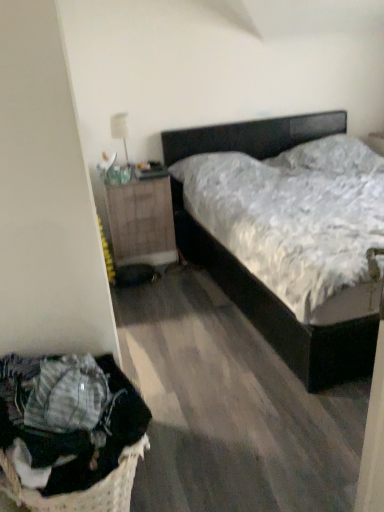
What is the approximate width of wooden nightstand at left?

22.83 inches.

Where is `wooden nightstand at left`? wooden nightstand at left is located at coordinates (141, 221).

Identify the location of wooden nightstand at left. click(x=141, y=221).

In the image, is wooden nightstand at left on the left side or the right side of black matte bed at center?

wooden nightstand at left is positioned on black matte bed at center's left side.

Based on the photo, does wooden nightstand at left have a lesser height compared to black matte bed at center?

Yes, wooden nightstand at left is shorter than black matte bed at center.

Is wooden nightstand at left inside the boundaries of black matte bed at center, or outside?

wooden nightstand at left cannot be found inside black matte bed at center.

Considering the sizes of objects wooden nightstand at left and black matte bed at center in the image provided, who is bigger, wooden nightstand at left or black matte bed at center?

Bigger between the two is black matte bed at center.

What's the angular difference between woven fabric laundry basket at lower left and black matte bed at center's facing directions?

The facing directions of woven fabric laundry basket at lower left and black matte bed at center are 89.5 degrees apart.

Is woven fabric laundry basket at lower left bigger or smaller than black matte bed at center?

In the image, woven fabric laundry basket at lower left appears to be smaller than black matte bed at center.

From a real-world perspective, which object rests below the other?

woven fabric laundry basket at lower left is physically lower.

Does woven fabric laundry basket at lower left touch black matte bed at center?

woven fabric laundry basket at lower left is not next to black matte bed at center, and they're not touching.

Which object is wider, wooden nightstand at left or woven fabric laundry basket at lower left?

Wider between the two is wooden nightstand at left.

From the image's perspective, is wooden nightstand at left located above or below woven fabric laundry basket at lower left?

wooden nightstand at left is situated higher than woven fabric laundry basket at lower left in the image.

Identify the location of laundry basket lying on the right of wooden nightstand at left. point(71,432).

Is woven fabric laundry basket at lower left surrounded by wooden nightstand at left?

No, woven fabric laundry basket at lower left is not a part of wooden nightstand at left.

Is black matte bed at center positioned before woven fabric laundry basket at lower left?

No, the depth of black matte bed at center is greater than that of woven fabric laundry basket at lower left.

From a real-world perspective, is black matte bed at center located beneath woven fabric laundry basket at lower left?

No, from a real-world perspective, black matte bed at center is not below woven fabric laundry basket at lower left.

From the picture: Is black matte bed at center not inside woven fabric laundry basket at lower left?

Absolutely, black matte bed at center is external to woven fabric laundry basket at lower left.

Are black matte bed at center and woven fabric laundry basket at lower left making contact?

black matte bed at center and woven fabric laundry basket at lower left are clearly separated.

Considering the sizes of black matte bed at center and wooden nightstand at left in the image, is black matte bed at center taller or shorter than wooden nightstand at left?

In the image, black matte bed at center appears to be taller than wooden nightstand at left.

From a real-world perspective, relative to wooden nightstand at left, is black matte bed at center vertically above or below?

black matte bed at center is situated higher than wooden nightstand at left in the real world.

Is point (333, 362) farther from viewer compared to point (154, 230)?

No, it is in front of (154, 230).

Considering the sizes of objects black matte bed at center and wooden nightstand at left in the image provided, who is bigger, black matte bed at center or wooden nightstand at left?

With larger size is black matte bed at center.

Could you tell me if woven fabric laundry basket at lower left is facing wooden nightstand at left?

No, woven fabric laundry basket at lower left is not facing towards wooden nightstand at left.

In terms of size, does woven fabric laundry basket at lower left appear bigger or smaller than wooden nightstand at left?

In the image, woven fabric laundry basket at lower left appears to be smaller than wooden nightstand at left.

Between woven fabric laundry basket at lower left and wooden nightstand at left, which one has larger width?

Wider between the two is wooden nightstand at left.

Can you confirm if woven fabric laundry basket at lower left is shorter than wooden nightstand at left?

Yes.

What are the coordinates of `bed in front of the wooden nightstand at left` in the screenshot? It's located at (280, 313).

You are a GUI agent. You are given a task and a screenshot of the screen. Output one action in this format:
    pyautogui.click(x=<x>, y=<y>)
    Task: Click on the laundry basket that is under the black matte bed at center (from a real-world perspective)
    Image resolution: width=384 pixels, height=512 pixels.
    Given the screenshot: What is the action you would take?
    pyautogui.click(x=71, y=432)

Looking at the image, which one is located further to black matte bed at center, woven fabric laundry basket at lower left or wooden nightstand at left?

The object further to black matte bed at center is woven fabric laundry basket at lower left.

Considering their positions, is woven fabric laundry basket at lower left positioned further to wooden nightstand at left than black matte bed at center?

woven fabric laundry basket at lower left lies further to wooden nightstand at left than the other object.

From the image, which object appears to be nearer to wooden nightstand at left, black matte bed at center or woven fabric laundry basket at lower left?

black matte bed at center is positioned closer to the anchor wooden nightstand at left.

Based on their spatial positions, is wooden nightstand at left or woven fabric laundry basket at lower left further from black matte bed at center?

Among the two, woven fabric laundry basket at lower left is located further to black matte bed at center.

Looking at the image, which one is located further to woven fabric laundry basket at lower left, wooden nightstand at left or black matte bed at center?

wooden nightstand at left is further to woven fabric laundry basket at lower left.

Looking at the image, which one is located further to woven fabric laundry basket at lower left, black matte bed at center or wooden nightstand at left?

wooden nightstand at left is further to woven fabric laundry basket at lower left.

Identify the location of bed between woven fabric laundry basket at lower left and wooden nightstand at left in the front-back direction. The width and height of the screenshot is (384, 512). (280, 313).